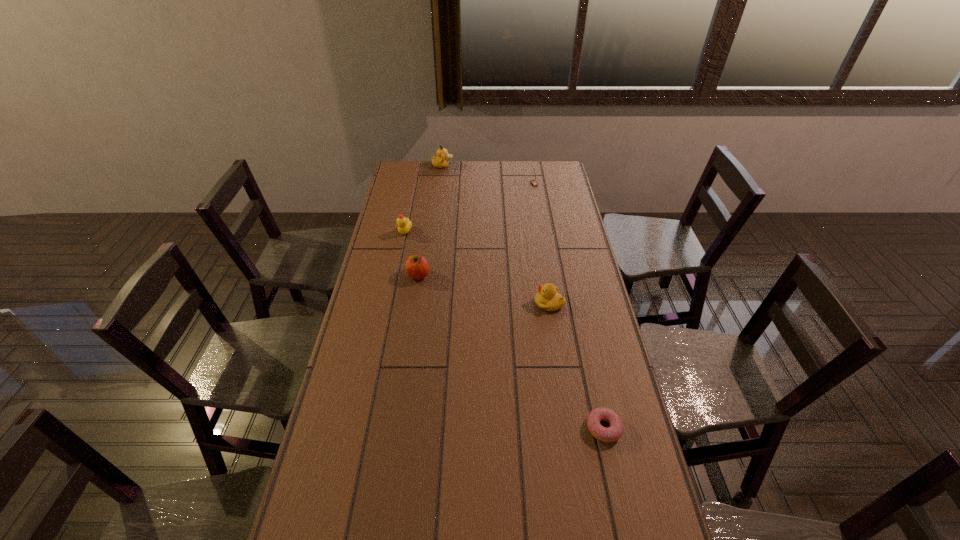
The width and height of the screenshot is (960, 540). Identify the location of duckling at the left edge. (404, 225).

At what (x,y) coordinates should I click in order to perform the action: click on apple located in the left edge section of the desktop. Please return your answer as a coordinate pair (x, y). Looking at the image, I should click on (417, 267).

At what (x,y) coordinates should I click in order to perform the action: click on matchbox located in the right edge section of the desktop. Please return your answer as a coordinate pair (x, y). This screenshot has width=960, height=540. Looking at the image, I should click on (533, 182).

You are a GUI agent. You are given a task and a screenshot of the screen. Output one action in this format:
    pyautogui.click(x=<x>, y=<y>)
    Task: Click on the duckling that is at the right edge
    The width and height of the screenshot is (960, 540).
    Given the screenshot: What is the action you would take?
    pyautogui.click(x=548, y=299)

Image resolution: width=960 pixels, height=540 pixels. I want to click on doughnut located at the right edge, so [x=614, y=432].

Locate an element on the screen. The image size is (960, 540). object that is at the far right corner is located at coordinates (533, 182).

This screenshot has width=960, height=540. Identify the location of free space at the far edge of the desktop. (516, 178).

In order to click on free spot at the left edge of the desktop in this screenshot , I will do `click(419, 209)`.

At what (x,y) coordinates should I click in order to perform the action: click on free space at the right edge of the desktop. Please return your answer as a coordinate pair (x, y). Looking at the image, I should click on (574, 349).

In the image, there is a desktop. At what (x,y) coordinates should I click in order to perform the action: click on free space at the far left corner. Please return your answer as a coordinate pair (x, y). Image resolution: width=960 pixels, height=540 pixels. Looking at the image, I should click on (425, 161).